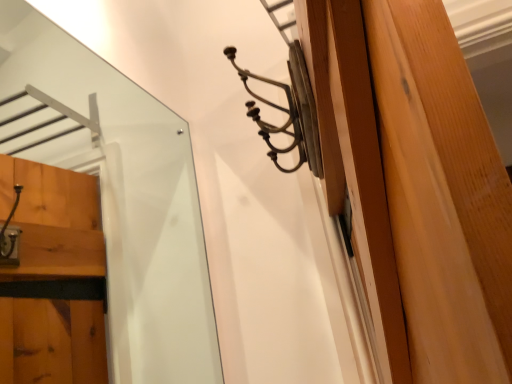
At what (x,y) coordinates should I click in order to perform the action: click on metallic coat rack at upper center. Please return your answer as a coordinate pair (x, y). Looking at the image, I should click on (288, 111).

The image size is (512, 384). What do you see at coordinates (288, 111) in the screenshot?
I see `metallic coat rack at upper center` at bounding box center [288, 111].

The height and width of the screenshot is (384, 512). What are the coordinates of `metallic coat rack at upper center` in the screenshot? It's located at (288, 111).